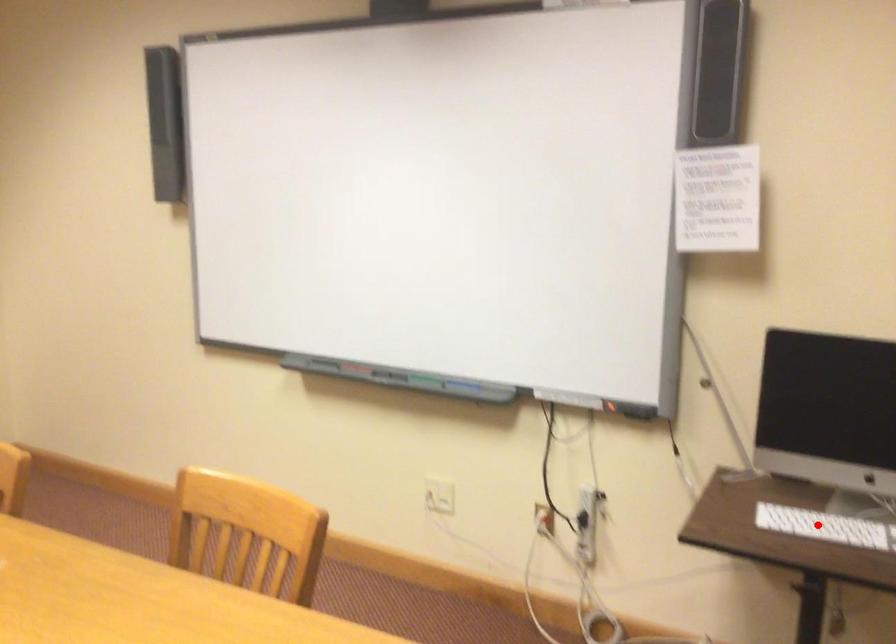
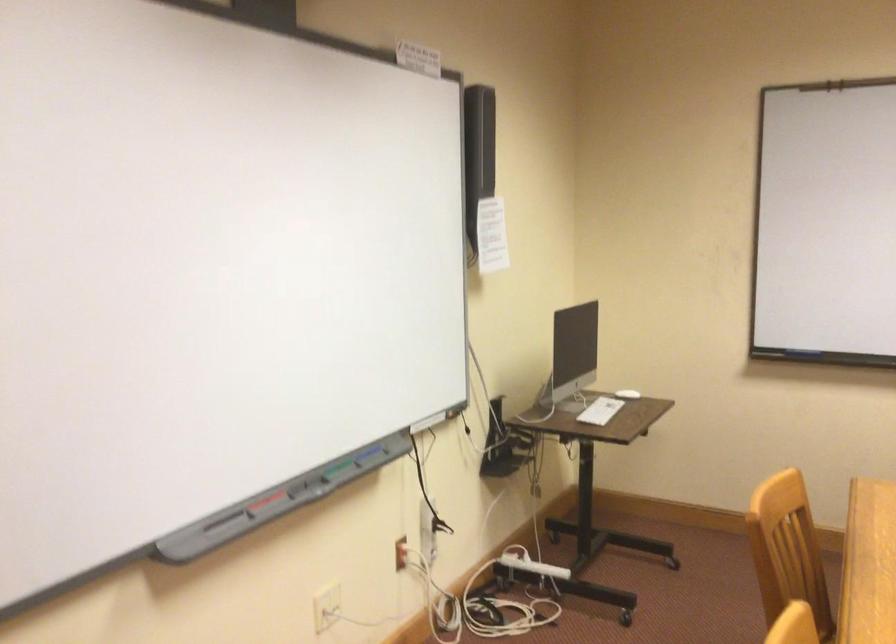
Question: A red point is marked in image1. In image2, is the corresponding 3D point closer to the camera or farther? Reply with the corresponding letter.

Choices:
 (A) The corresponding 3D point is closer.
 (B) The corresponding 3D point is farther.

Answer: (B)